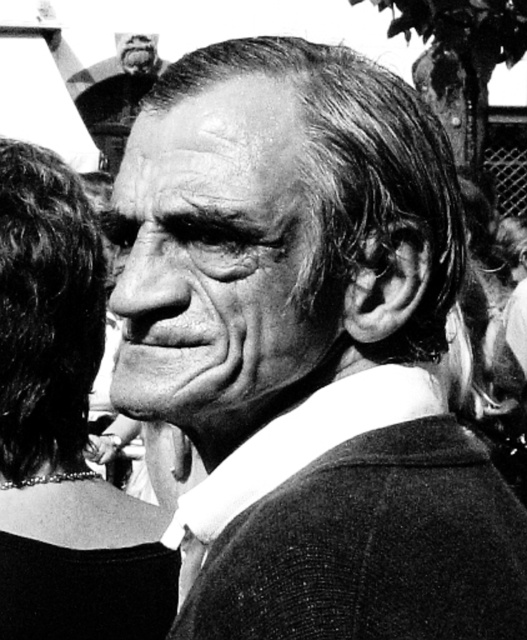
Question: Is smooth skin face at center bigger than smooth black hair at left?

Choices:
 (A) yes
 (B) no

Answer: (B)

Question: Does smooth skin face at center appear under smooth black hair at left?

Choices:
 (A) yes
 (B) no

Answer: (B)

Question: Which object is farther from the camera taking this photo?

Choices:
 (A) smooth skin face at center
 (B) smooth black hair at left

Answer: (B)

Question: Where is smooth skin face at center located in relation to smooth black hair at left in the image?

Choices:
 (A) left
 (B) right

Answer: (B)